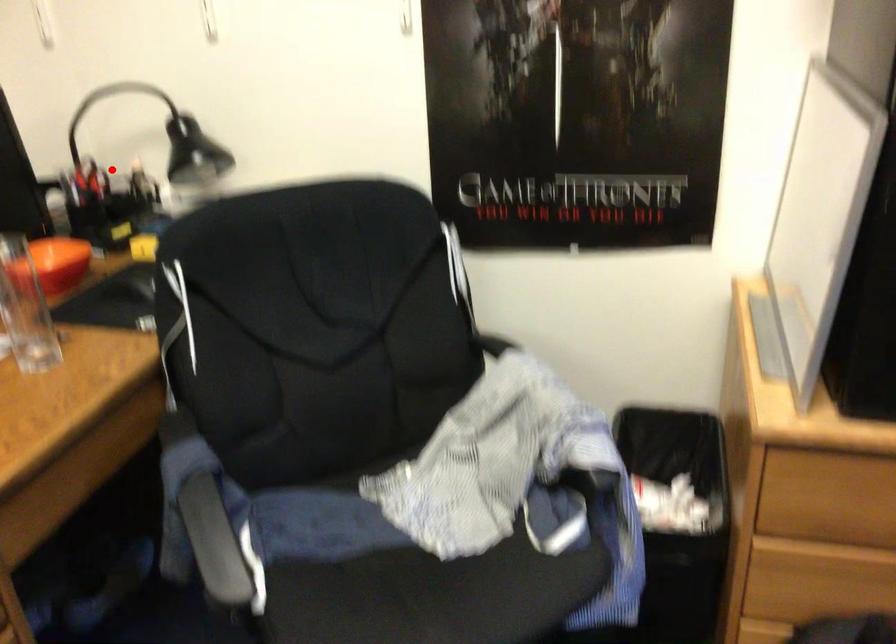
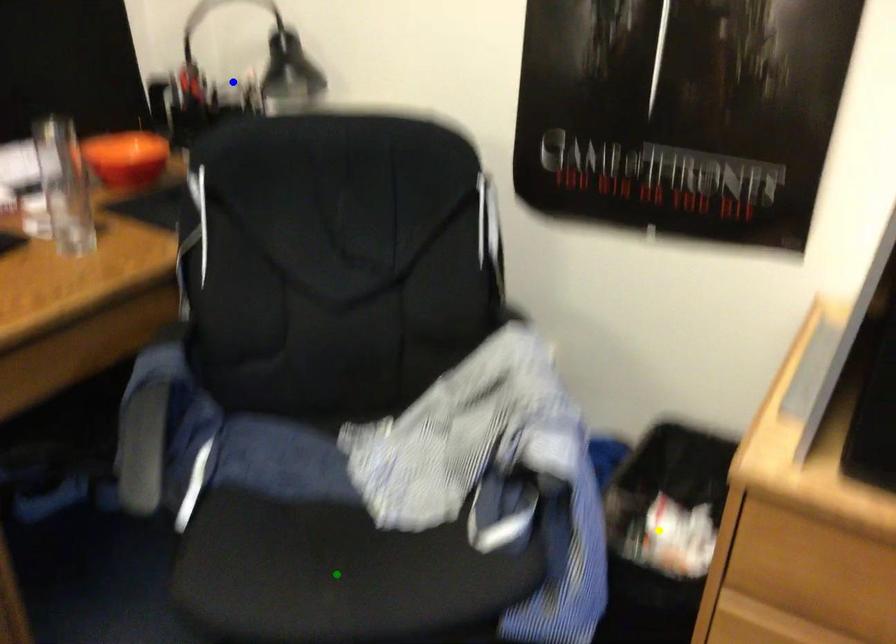
Question: I am providing you with two images of the same scene from different viewpoints. A red point is marked on the first image. You are given multiple points on the second image. Which point in image 2 is actually the same real-world point as the red point in image 1?

Choices:
 (A) yellow point
 (B) blue point
 (C) green point

Answer: (B)